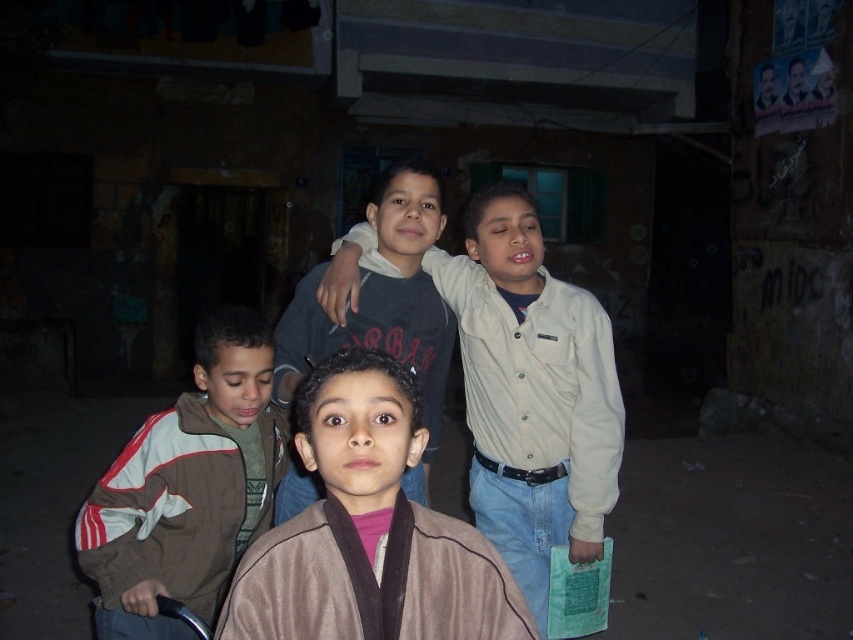
You are a photographer trying to capture a clear image of both the brown suede jacket at center and the brown fleece jacket at lower left. Which jacket will appear larger in your photo?

The brown suede jacket at center will appear larger in the photo because it is closer to the viewer than the brown fleece jacket at lower left.